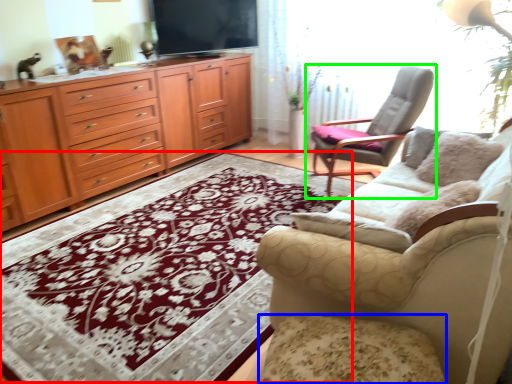
Question: Considering the real-world distances, which object is closest to mat (highlighted by a red box)? footrest (highlighted by a blue box) or chair (highlighted by a green box).

Choices:
 (A) footrest
 (B) chair

Answer: (A)